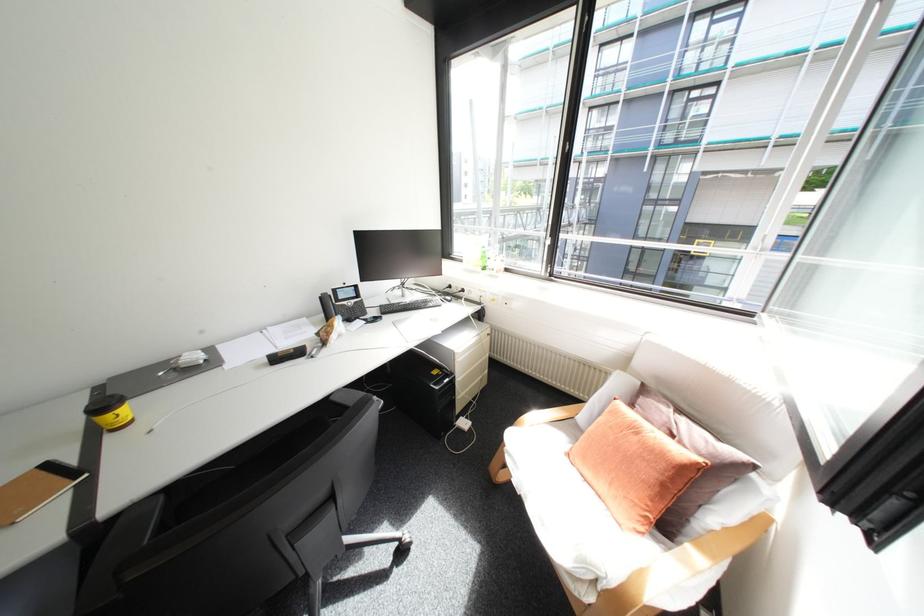
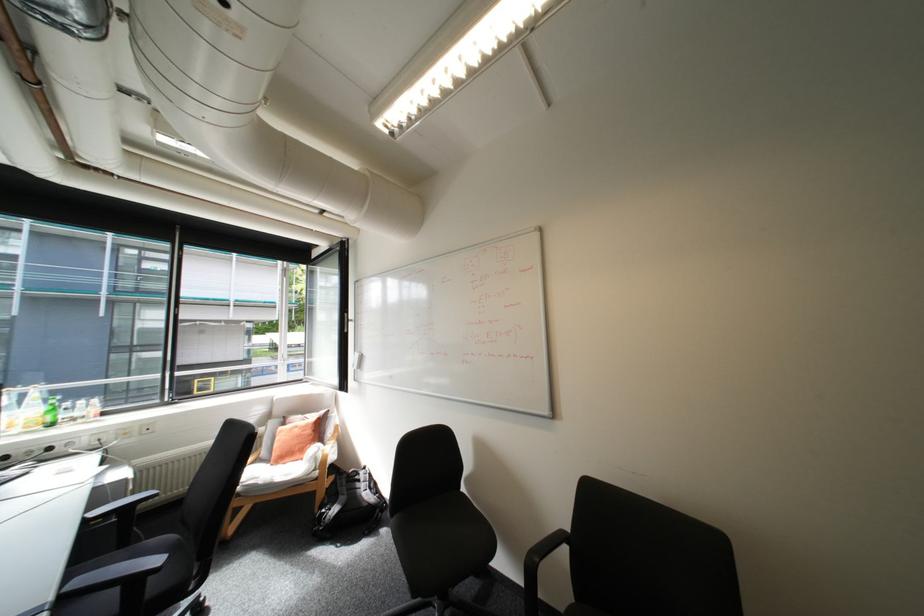
In the second image, find the point that corresponds to [645,439] in the first image.

(307, 429)